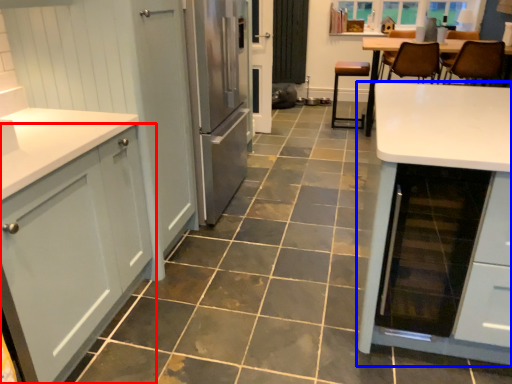
Question: Which object is closer to the camera taking this photo, cabinetry (highlighted by a red box) or table (highlighted by a blue box)?

Choices:
 (A) cabinetry
 (B) table

Answer: (A)